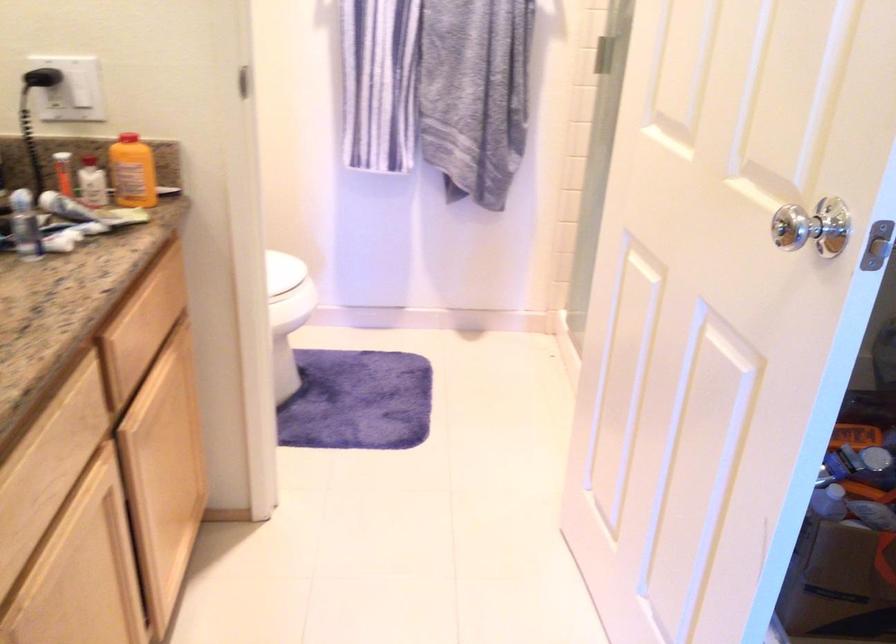
Where would you lift the white toilet lid? Please return your answer as a coordinate pair (x, y).

(282, 270)